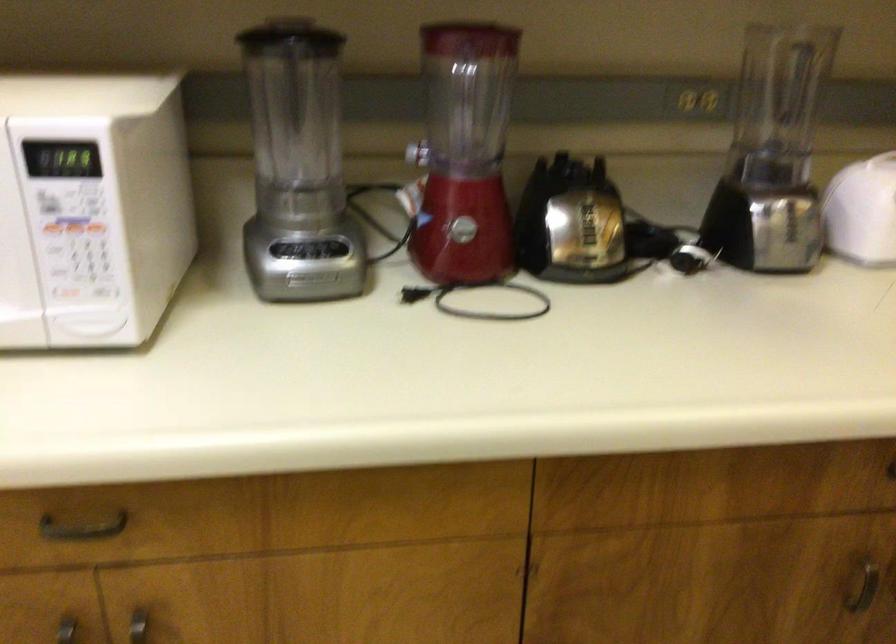
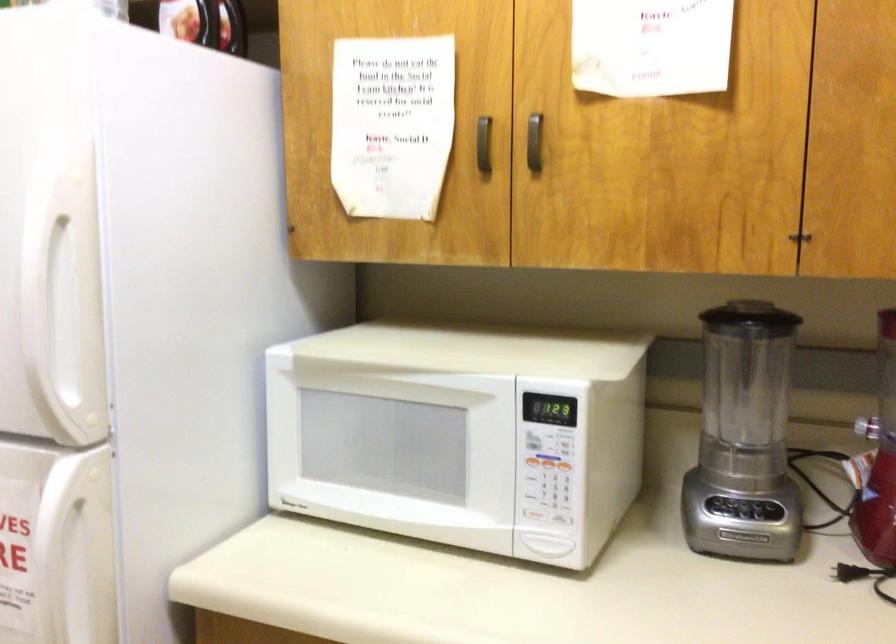
The point at (x=100, y=289) is marked in the first image. Where is the corresponding point in the second image?

(563, 518)